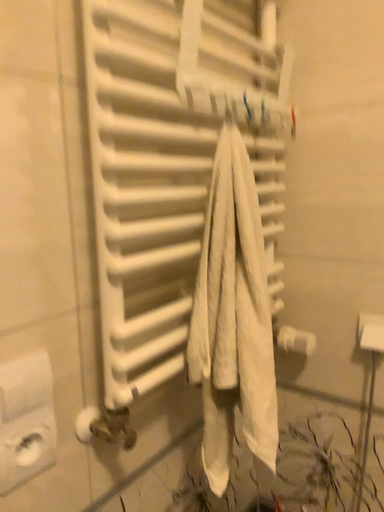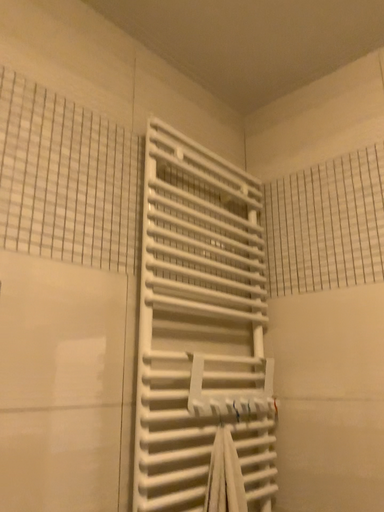
Question: Which way did the camera rotate in the video?

Choices:
 (A) rotated upward
 (B) rotated downward

Answer: (A)